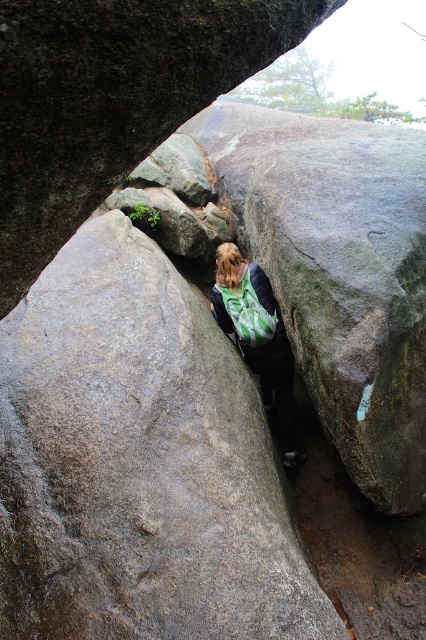
You are a hiker trying to navigate through the narrow passage between two large boulders. You need to know the exact location of the gray rough boulder at center to plan your path. What are its coordinates?

The gray rough boulder at center is located at coordinates point (112, 99).

You are a hiker trying to pass through the narrow passage between two large boulders. You have a green fabric backpack at center. The gray rough boulder at center is in your path. Can your backpack fit through the passage without getting stuck?

The gray rough boulder at center might be wider than green fabric backpack at center, so there is a possibility that the backpack could fit through the passage if the boulder is wider. However, if the boulder is narrower, the backpack might get stuck. It depends on the actual width comparison between the two.

You are a hiker trying to pass through the narrow passage between the two large boulders. You notice the gray rough boulder at center and the green fabric backpack at center. Which object is blocking your path more?

The gray rough boulder at center is positioned over the green fabric backpack at center, so it is blocking your path more.